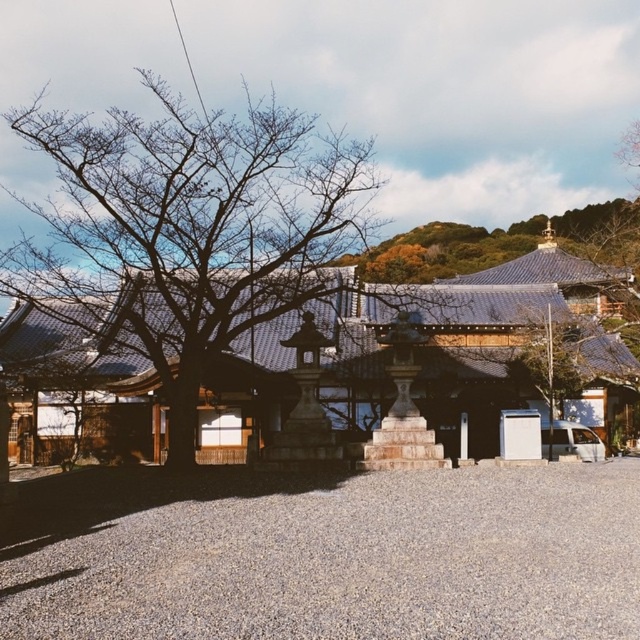
Is gray gravel at center smaller than bare wood tree at left?

Indeed, gray gravel at center has a smaller size compared to bare wood tree at left.

Describe the element at coordinates (323, 554) in the screenshot. The width and height of the screenshot is (640, 640). I see `gray gravel at center` at that location.

Which is behind, point (144, 541) or point (272, 145)?

The point (272, 145) is more distant.

At what (x,y) coordinates should I click in order to perform the action: click on gray gravel at center. Please return your answer as a coordinate pair (x, y). Looking at the image, I should click on (323, 554).